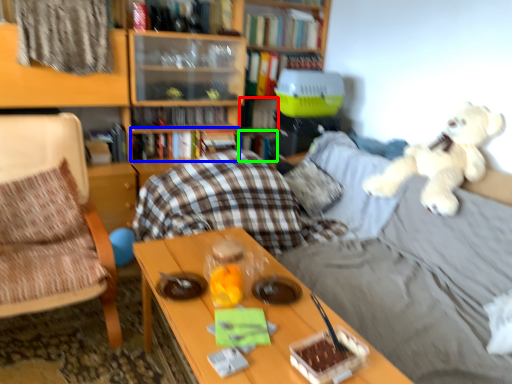
Question: Estimate the real-world distances between objects in this image. Which object is closer to book (highlighted by a red box), book (highlighted by a blue box) or book (highlighted by a green box)?

Choices:
 (A) book
 (B) book

Answer: (B)